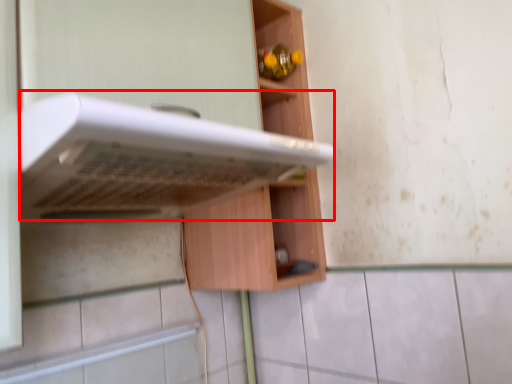
Question: From the image's perspective, where is oven (annotated by the red box) located in relation to cabinetry in the image?

Choices:
 (A) below
 (B) above

Answer: (A)